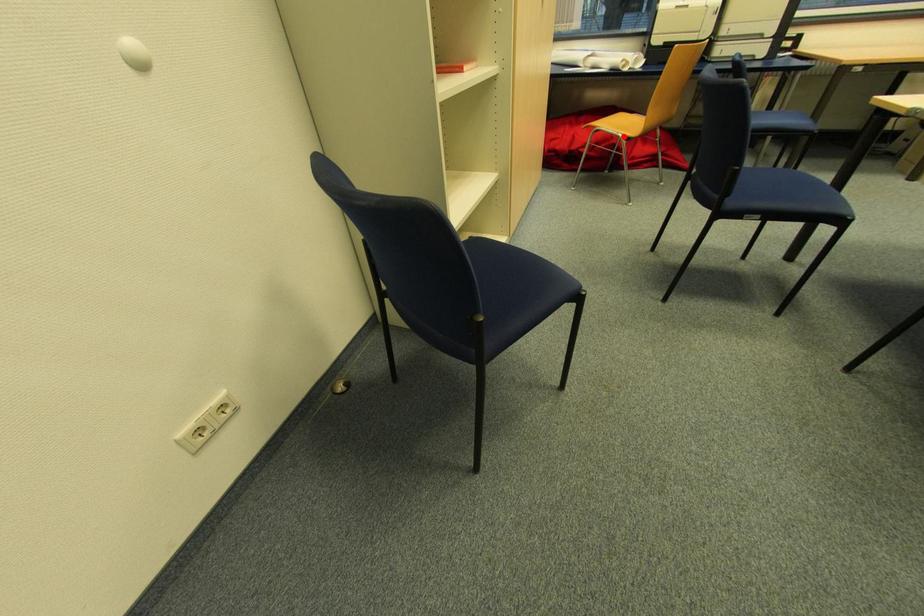
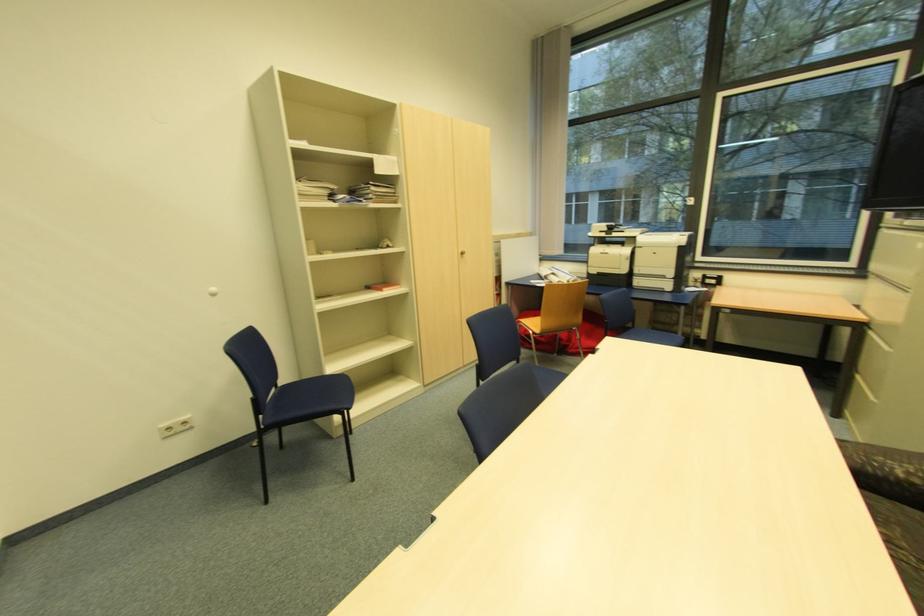
In the second image, find the point that corresponds to the highlighted location in the first image.

(532, 331)